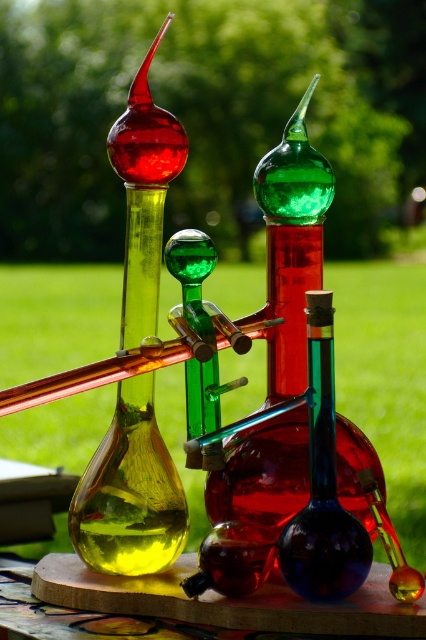
You are setting up a display for an art exhibition and need to place both the wooden board at center and the blue glass bottle at center on a shelf. Given their sizes, which object should you place first to ensure stability?

The wooden board at center is larger in size than the blue glass bottle at center, so you should place the wooden board at center first to establish a stable base before placing the smaller blue glass bottle at center on top or beside it.

You are standing 10 inches away from the wooden surface where the colorful glass bottles are placed. You want to reach a point that is exactly 13.02 inches away from you. Can you reach the point at coordinates point (313,435)?

The distance of point (313,435) from viewer is 13.02 inches. Since you are currently 10 inches away from the wooden surface, moving forward 3.02 inches would bring you close enough to reach the point at point 0.680, 0.637.

You are an artist planning to place a 1.5 inch wide decorative stone between the green glass bottle at center and the blue glass bottle at center. Based on the spacing between them, will the stone fit without overlapping either bottle?

The green glass bottle at center and blue glass bottle at center are only 0.80 inches apart, which is less than the 1.5 inch width of the stone. Therefore, the stone will not fit between them without overlapping the bottles.